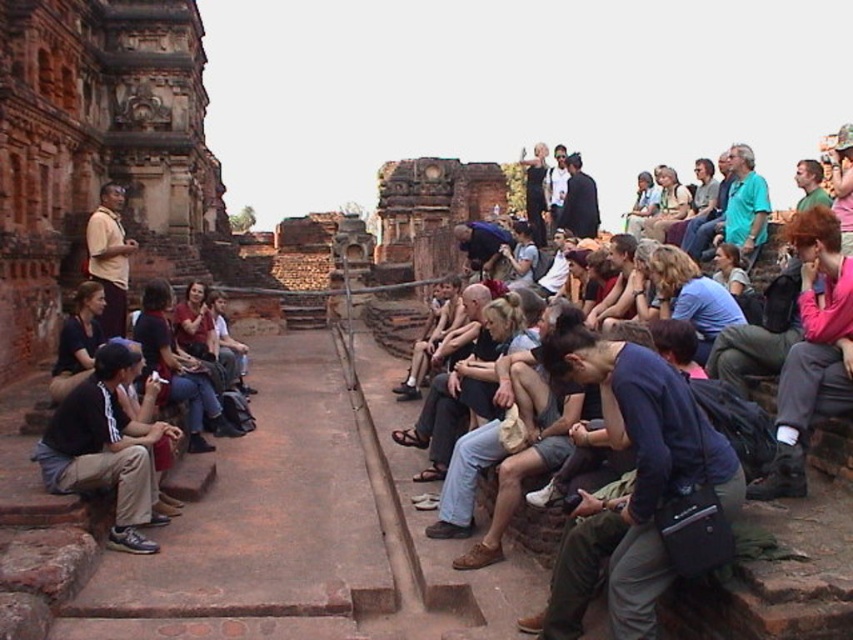
You are a tour guide leading a group through the ancient temple complex. You notice two visitors wearing dark brown cotton pants at left and dark blue jeans at center. If you want to ensure everyone stays within the walkway, which of the two visitors might have more difficulty walking side by side with others due to their clothing width?

The dark brown cotton pants at left has a lesser width compared to the dark blue jeans at center. Therefore, the visitor wearing the dark brown cotton pants at left might have more difficulty walking side by side with others because their clothing is narrower, potentially making it harder to navigate the walkway comfortably.

Looking at this image, you are a photographer planning to take a group photo of the people in the temple complex. You notice the pink fabric jacket at right and the dark brown cotton pants at left. Which clothing item should you focus on if you want to include both in the frame without cropping either?

The pink fabric jacket at right is taller than the dark brown cotton pants at left, so you should focus on the pink fabric jacket at right to ensure both items are fully visible in the frame.